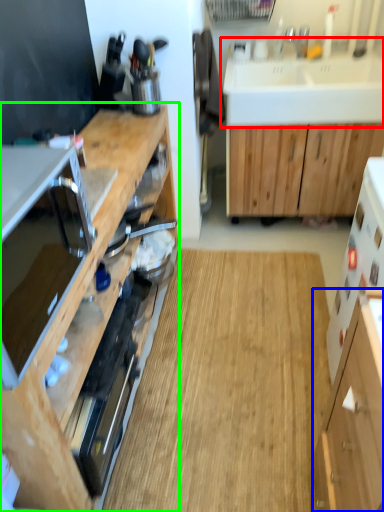
Question: Based on their relative distances, which object is nearer to sink (highlighted by a red box)? Choose from cabinetry (highlighted by a blue box) and cabinetry (highlighted by a green box).

Choices:
 (A) cabinetry
 (B) cabinetry

Answer: (B)